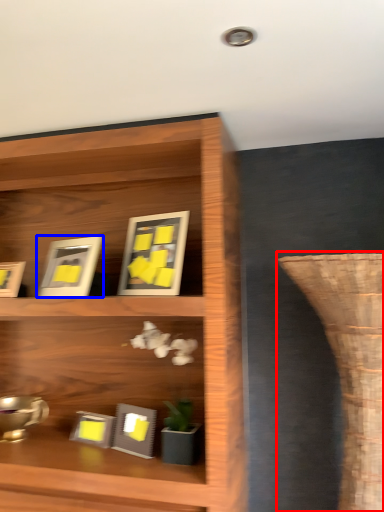
Question: Which point is closer to the camera, vase (highlighted by a red box) or picture frame (highlighted by a blue box)?

Choices:
 (A) vase
 (B) picture frame

Answer: (A)